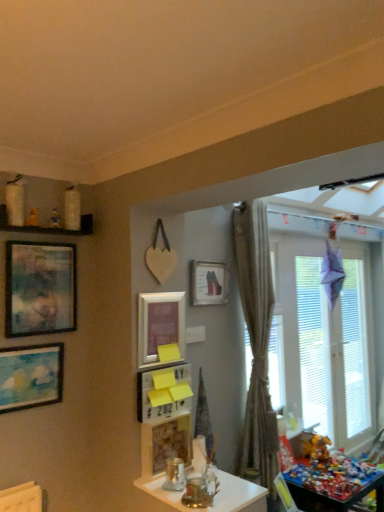
Question: In which direction should I rotate to look at matte white picture frame at center, positioned as the first picture frame in right-to-left order?

Choices:
 (A) left
 (B) right

Answer: (B)

Question: Are matte pink picture frame at center, positioned as the third picture frame in right-to-left order, and white frosted glass window at right beside each other?

Choices:
 (A) no
 (B) yes

Answer: (A)

Question: Does matte pink picture frame at center, which is the third picture frame from left to right, have a smaller size compared to white frosted glass window at right?

Choices:
 (A) yes
 (B) no

Answer: (A)

Question: Does matte pink picture frame at center, which is the third picture frame from left to right, have a lesser height compared to white frosted glass window at right?

Choices:
 (A) no
 (B) yes

Answer: (B)

Question: Is matte pink picture frame at center, which is the third picture frame from left to right, closer to camera compared to white frosted glass window at right?

Choices:
 (A) no
 (B) yes

Answer: (B)

Question: Is matte pink picture frame at center, positioned as the third picture frame in right-to-left order, thinner than white frosted glass window at right?

Choices:
 (A) yes
 (B) no

Answer: (A)

Question: Is matte pink picture frame at center, which is the third picture frame from left to right, far from white frosted glass window at right?

Choices:
 (A) no
 (B) yes

Answer: (B)

Question: From the image's perspective, is matte blue painting at left, the 1th picture frame positioned from the left, located beneath white glossy jars at upper left?

Choices:
 (A) yes
 (B) no

Answer: (A)

Question: Does matte blue painting at left, which is the 5th picture frame from right to left, have a greater width compared to white glossy jars at upper left?

Choices:
 (A) yes
 (B) no

Answer: (B)

Question: Is the position of matte blue painting at left, the 1th picture frame positioned from the left, less distant than that of white glossy jars at upper left?

Choices:
 (A) yes
 (B) no

Answer: (A)

Question: Considering the relative sizes of matte blue painting at left, which is the 5th picture frame from right to left, and white glossy jars at upper left in the image provided, is matte blue painting at left, which is the 5th picture frame from right to left, taller than white glossy jars at upper left?

Choices:
 (A) no
 (B) yes

Answer: (B)

Question: Is matte blue painting at left, which is the 5th picture frame from right to left, smaller than white glossy jars at upper left?

Choices:
 (A) yes
 (B) no

Answer: (A)

Question: Considering the relative sizes of matte blue painting at left, the 1th picture frame positioned from the left, and white glossy jars at upper left in the image provided, is matte blue painting at left, the 1th picture frame positioned from the left, bigger than white glossy jars at upper left?

Choices:
 (A) no
 (B) yes

Answer: (A)

Question: Considering the relative sizes of multicolored plastic toys at lower right, the second table in the front-to-back sequence, and white frosted glass window at right in the image provided, is multicolored plastic toys at lower right, the second table in the front-to-back sequence, smaller than white frosted glass window at right?

Choices:
 (A) no
 (B) yes

Answer: (B)